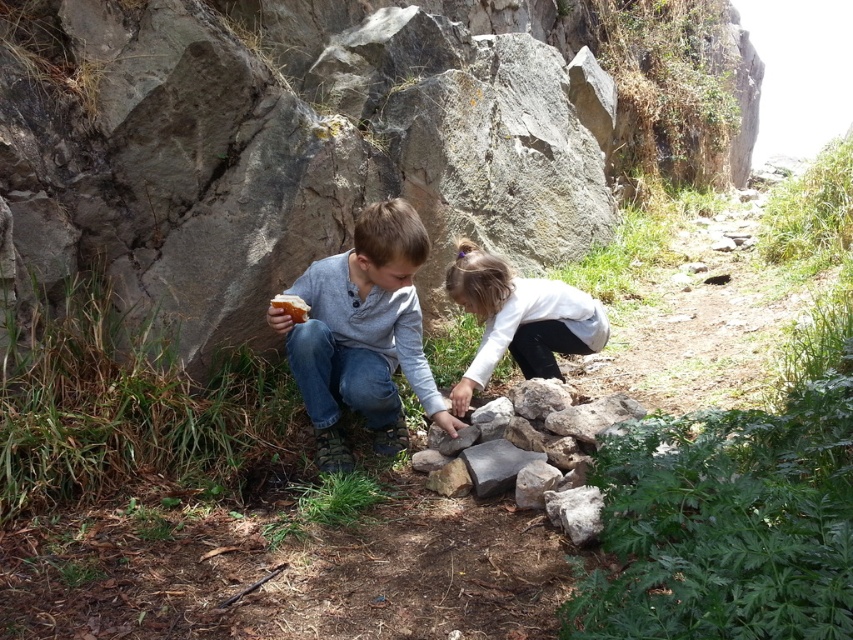
Is matte gray sweater at center smaller than gray rough rock at center?

No.

Which is behind, point (416, 330) or point (637, 413)?

The point (416, 330) is more distant.

Locate an element on the screen. Image resolution: width=853 pixels, height=640 pixels. matte gray sweater at center is located at coordinates (363, 336).

Is point (440, 404) more distant than point (474, 264)?

No, (440, 404) is in front of (474, 264).

Is matte gray sweater at center behind white matte shirt at center?

No.

This screenshot has height=640, width=853. What do you see at coordinates (363, 336) in the screenshot?
I see `matte gray sweater at center` at bounding box center [363, 336].

Locate an element on the screen. This screenshot has width=853, height=640. matte gray sweater at center is located at coordinates (363, 336).

The width and height of the screenshot is (853, 640). What are the coordinates of `gray rough rock at center` in the screenshot? It's located at (550, 452).

Can you confirm if gray rough rock at center is taller than white bread at center?

Correct, gray rough rock at center is much taller as white bread at center.

Find the location of `gray rough rock at center`. gray rough rock at center is located at coordinates (550, 452).